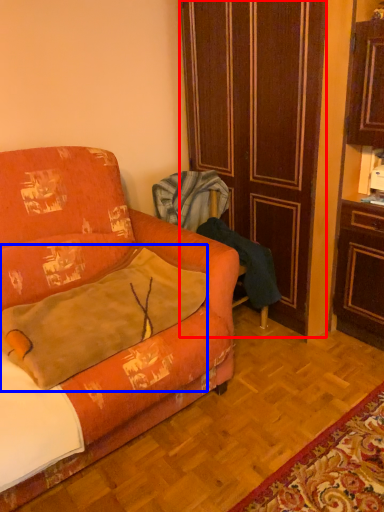
Question: Which object appears farthest to the camera in this image, door (highlighted by a red box) or throw pillow (highlighted by a blue box)?

Choices:
 (A) door
 (B) throw pillow

Answer: (A)